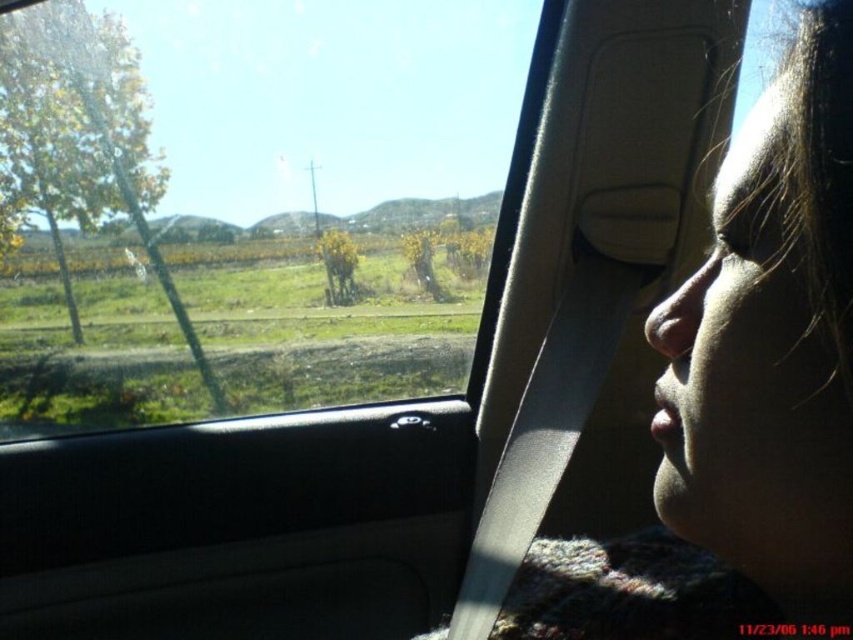
Question: Which of the following is the farthest from the observer?

Choices:
 (A) white fluffy bird at left
 (B) smooth skin face at upper right
 (C) transparent glass car window at center

Answer: (A)

Question: Is transparent glass car window at center bigger than smooth skin face at upper right?

Choices:
 (A) yes
 (B) no

Answer: (A)

Question: Based on their relative distances, which object is farther from the smooth skin face at upper right?

Choices:
 (A) white fluffy bird at left
 (B) transparent glass car window at center

Answer: (A)

Question: Observing the image, what is the correct spatial positioning of smooth skin face at upper right in reference to white fluffy bird at left?

Choices:
 (A) right
 (B) left

Answer: (A)

Question: Which point is farther from the camera taking this photo?

Choices:
 (A) (4, 172)
 (B) (134, 273)
 (C) (728, 284)

Answer: (B)

Question: Considering the relative positions of transparent glass car window at center and smooth skin face at upper right in the image provided, where is transparent glass car window at center located with respect to smooth skin face at upper right?

Choices:
 (A) right
 (B) left

Answer: (B)